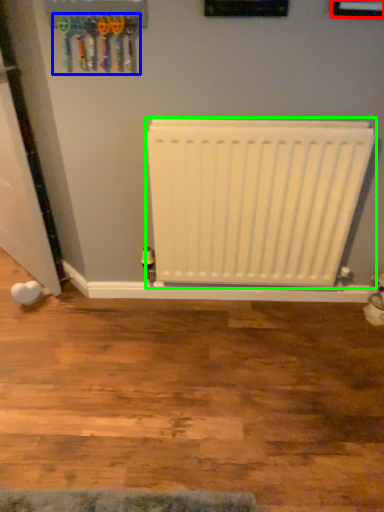
Question: Considering the real-world distances, which object is closest to picture frame (highlighted by a red box)? tool (highlighted by a blue box) or radiator (highlighted by a green box).

Choices:
 (A) tool
 (B) radiator

Answer: (B)